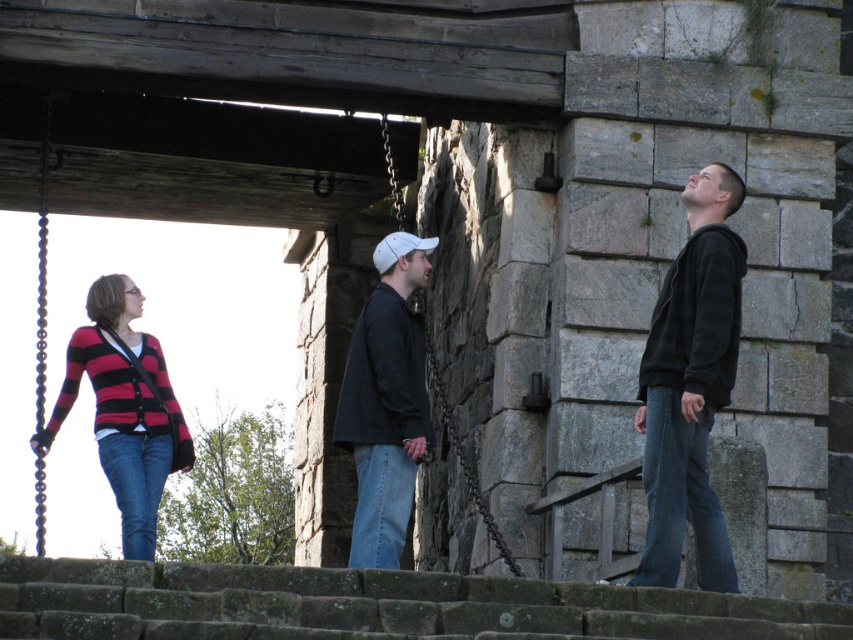
Question: Which point is closer to the camera?

Choices:
 (A) denim at center
 (B) dark gray sweater at center

Answer: (B)

Question: Is blue denim jeans at right to the left of denim at left from the viewer's perspective?

Choices:
 (A) yes
 (B) no

Answer: (B)

Question: Can you confirm if denim at center is positioned below denim at left?

Choices:
 (A) no
 (B) yes

Answer: (B)

Question: Is dark gray sweater at center bigger than striped knit cardigan at left?

Choices:
 (A) yes
 (B) no

Answer: (A)

Question: Which point appears closest to the camera in this image?

Choices:
 (A) (695, 243)
 (B) (679, 422)
 (C) (136, 456)
 (D) (383, 499)

Answer: (B)

Question: Which of the following is the farthest from the observer?

Choices:
 (A) (396, 522)
 (B) (717, 524)
 (C) (419, 262)
 (D) (128, 292)

Answer: (D)